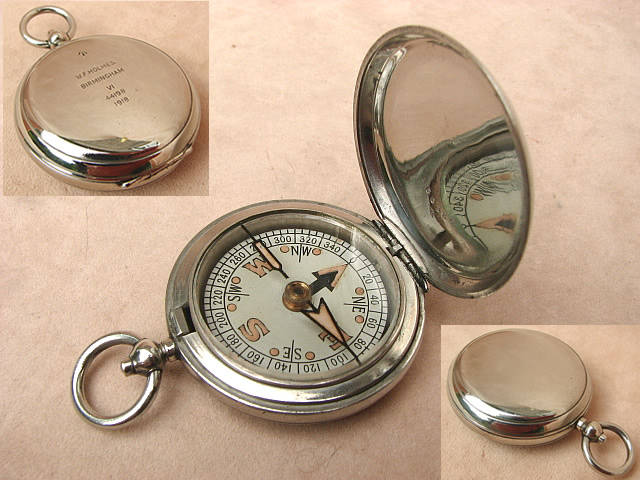
You are a GUI agent. You are given a task and a screenshot of the screen. Output one action in this format:
    pyautogui.click(x=<x>, y=<y>)
    Task: Click on the table
    Image resolution: width=640 pixels, height=480 pixels.
    Given the screenshot: What is the action you would take?
    pyautogui.click(x=340, y=38)